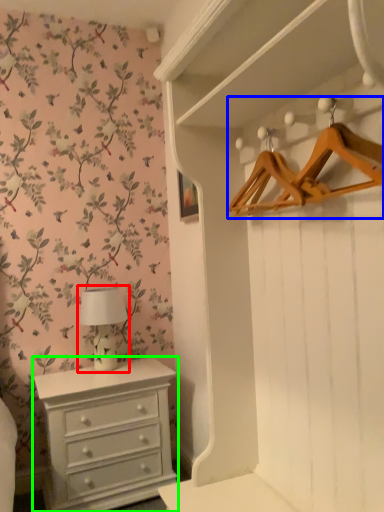
Question: Which object is the closest to the table lamp (highlighted by a red box)? Choose among these: hanger (highlighted by a blue box) or chest of drawers (highlighted by a green box).

Choices:
 (A) hanger
 (B) chest of drawers

Answer: (B)